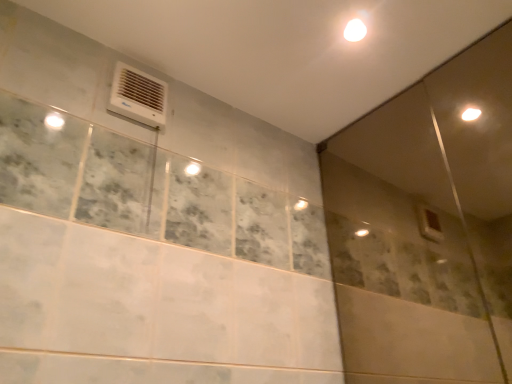
The height and width of the screenshot is (384, 512). Find the location of `white plastic air conditioning unit at upper left`. white plastic air conditioning unit at upper left is located at coordinates (138, 96).

In the scene shown: Does white glossy light at upper center contain white plastic air conditioning unit at upper left?

Actually, white plastic air conditioning unit at upper left is outside white glossy light at upper center.

Which object is more forward, white glossy light at upper center or white plastic air conditioning unit at upper left?

white plastic air conditioning unit at upper left.

Find the location of a particular element. This screenshot has width=512, height=384. light behind the white plastic air conditioning unit at upper left is located at coordinates (355, 30).

How distant is transparent glass screen door at upper right from white glossy light at upper center?

transparent glass screen door at upper right is 35.17 inches away from white glossy light at upper center.

From a real-world perspective, which object stands above the other?

A: white glossy light at upper center.

Is transparent glass screen door at upper right in front of or behind white glossy light at upper center in the image?

Visually, transparent glass screen door at upper right is located in front of white glossy light at upper center.

Which is more to the left, white plastic air conditioning unit at upper left or white glossy light at upper center?

Positioned to the left is white plastic air conditioning unit at upper left.

From the picture: Considering their positions, is white plastic air conditioning unit at upper left located in front of or behind white glossy light at upper center?

white plastic air conditioning unit at upper left is in front of white glossy light at upper center.

Is white plastic air conditioning unit at upper left bigger than white glossy light at upper center?

Indeed, white plastic air conditioning unit at upper left has a larger size compared to white glossy light at upper center.

Do you think white plastic air conditioning unit at upper left is within white glossy light at upper center, or outside of it?

white plastic air conditioning unit at upper left exists outside the volume of white glossy light at upper center.

Could you measure the distance between white glossy light at upper center and transparent glass screen door at upper right?

The distance of white glossy light at upper center from transparent glass screen door at upper right is 35.17 inches.

Considering the sizes of white glossy light at upper center and transparent glass screen door at upper right in the image, is white glossy light at upper center taller or shorter than transparent glass screen door at upper right?

Considering their sizes, white glossy light at upper center has less height than transparent glass screen door at upper right.

Is white glossy light at upper center positioned far away from transparent glass screen door at upper right?

Actually, white glossy light at upper center and transparent glass screen door at upper right are a little close together.

Is point (353, 41) behind point (421, 158)?

No, it is not.

Considering the relative sizes of white plastic air conditioning unit at upper left and transparent glass screen door at upper right in the image provided, is white plastic air conditioning unit at upper left shorter than transparent glass screen door at upper right?

Correct, white plastic air conditioning unit at upper left is not as tall as transparent glass screen door at upper right.

Between white plastic air conditioning unit at upper left and transparent glass screen door at upper right, which one has smaller width?

transparent glass screen door at upper right.

Does white plastic air conditioning unit at upper left turn towards transparent glass screen door at upper right?

No.

Can you tell me how much white plastic air conditioning unit at upper left and transparent glass screen door at upper right differ in facing direction?

The angular difference between white plastic air conditioning unit at upper left and transparent glass screen door at upper right is 88.9 degrees.

Consider the image. Between transparent glass screen door at upper right and white plastic air conditioning unit at upper left, which one has less height?

white plastic air conditioning unit at upper left is shorter.

Would you say transparent glass screen door at upper right is inside or outside white plastic air conditioning unit at upper left?

transparent glass screen door at upper right is outside white plastic air conditioning unit at upper left.

Between point (469, 310) and point (166, 101), which one is positioned behind?

The point (469, 310) is farther.

Is transparent glass screen door at upper right oriented away from white plastic air conditioning unit at upper left?

transparent glass screen door at upper right does not have its back to white plastic air conditioning unit at upper left.

I want to click on light above the white plastic air conditioning unit at upper left (from the image's perspective), so click(355, 30).

You are a GUI agent. You are given a task and a screenshot of the screen. Output one action in this format:
    pyautogui.click(x=<x>, y=<y>)
    Task: Click on the screen door that appears below the white glossy light at upper center (from a real-world perspective)
    The image size is (512, 384).
    Given the screenshot: What is the action you would take?
    pyautogui.click(x=426, y=226)

Which object lies further to the anchor point white plastic air conditioning unit at upper left, white glossy light at upper center or transparent glass screen door at upper right?

transparent glass screen door at upper right is further to white plastic air conditioning unit at upper left.

Considering their positions, is transparent glass screen door at upper right positioned further to white glossy light at upper center than white plastic air conditioning unit at upper left?

transparent glass screen door at upper right lies further to white glossy light at upper center than the other object.

Considering their positions, is white plastic air conditioning unit at upper left positioned further to white glossy light at upper center than transparent glass screen door at upper right?

transparent glass screen door at upper right.

Based on their spatial positions, is white plastic air conditioning unit at upper left or white glossy light at upper center further from transparent glass screen door at upper right?

Based on the image, white plastic air conditioning unit at upper left appears to be further to transparent glass screen door at upper right.

Which object lies nearer to the anchor point transparent glass screen door at upper right, white glossy light at upper center or white plastic air conditioning unit at upper left?

white glossy light at upper center is closer to transparent glass screen door at upper right.

Estimate the real-world distances between objects in this image. Which object is closer to white plastic air conditioning unit at upper left, transparent glass screen door at upper right or white glossy light at upper center?

white glossy light at upper center.

Find the location of a particular element. The image size is (512, 384). light between white plastic air conditioning unit at upper left and transparent glass screen door at upper right in the horizontal direction is located at coordinates (355, 30).